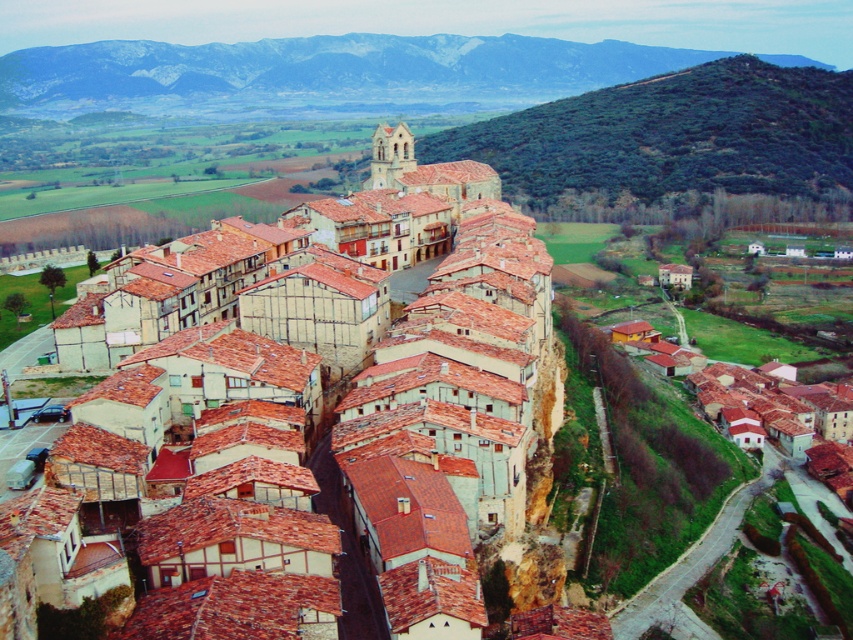
Question: Considering the relative positions of matte clay roof tiles at center and rocky brown mountain at upper center in the image provided, where is matte clay roof tiles at center located with respect to rocky brown mountain at upper center?

Choices:
 (A) right
 (B) left

Answer: (B)

Question: Estimate the real-world distances between objects in this image. Which object is farther from the green leafy hillside at upper right?

Choices:
 (A) matte clay roof tiles at center
 (B) rocky brown mountain at upper center

Answer: (A)

Question: Estimate the real-world distances between objects in this image. Which object is closer to the matte clay roof tiles at center?

Choices:
 (A) rocky brown mountain at upper center
 (B) green leafy hillside at upper right

Answer: (B)

Question: Is rocky brown mountain at upper center thinner than green leafy hillside at upper right?

Choices:
 (A) yes
 (B) no

Answer: (B)

Question: Which object appears farthest from the camera in this image?

Choices:
 (A) green leafy hillside at upper right
 (B) matte clay roof tiles at center

Answer: (A)

Question: Can you confirm if matte clay roof tiles at center is bigger than green leafy hillside at upper right?

Choices:
 (A) no
 (B) yes

Answer: (A)